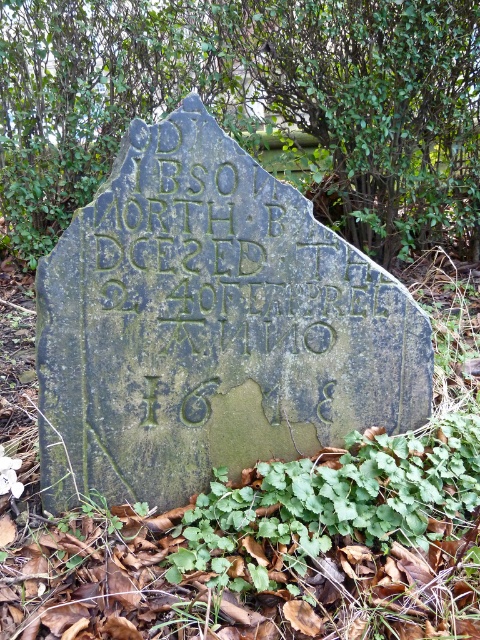
Question: Based on their relative distances, which object is nearer to the green leafy tree at upper center?

Choices:
 (A) green mossy stone gravestone at center
 (B) green leafy plant at lower center

Answer: (A)

Question: Does green mossy stone gravestone at center appear over green leafy plant at lower center?

Choices:
 (A) yes
 (B) no

Answer: (A)

Question: Which point appears closest to the camera in this image?

Choices:
 (A) (457, 428)
 (B) (13, 243)
 (C) (56, 401)

Answer: (C)

Question: Is green mossy stone gravestone at center further to camera compared to green leafy plant at lower center?

Choices:
 (A) no
 (B) yes

Answer: (B)

Question: Does green mossy stone gravestone at center have a smaller size compared to green leafy plant at lower center?

Choices:
 (A) no
 (B) yes

Answer: (A)

Question: Which object is positioned closest to the green leafy tree at upper center?

Choices:
 (A) green mossy stone gravestone at center
 (B) green leafy plant at lower center

Answer: (A)